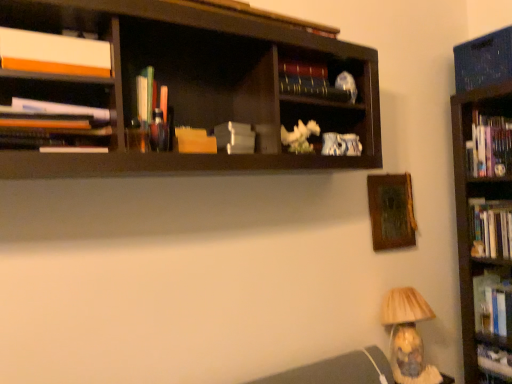
Question: Is hardcover books at right, the 8th book from the bottom, not near hardcover book at upper center, positioned as the first book in top-to-bottom order?

Choices:
 (A) yes
 (B) no

Answer: (A)

Question: Is hardcover books at right, which is the fourth book in top-to-bottom order, not within hardcover book at upper center, positioned as the first book in top-to-bottom order?

Choices:
 (A) yes
 (B) no

Answer: (A)

Question: Is hardcover books at right, which is the fourth book in top-to-bottom order, in contact with hardcover book at upper center, which is the 11th book in bottom-to-top order?

Choices:
 (A) no
 (B) yes

Answer: (A)

Question: Is the position of hardcover books at right, which is the fourth book in top-to-bottom order, more distant than that of hardcover book at upper center, which is the 11th book in bottom-to-top order?

Choices:
 (A) yes
 (B) no

Answer: (A)

Question: Is hardcover books at right, which is the fourth book in top-to-bottom order, to the right of hardcover book at upper center, which is the 11th book in bottom-to-top order, from the viewer's perspective?

Choices:
 (A) yes
 (B) no

Answer: (A)

Question: Is hardcover book at upper center, positioned as the first book in top-to-bottom order, located within hardcover books at right, the 8th book from the bottom?

Choices:
 (A) no
 (B) yes

Answer: (A)

Question: Can you confirm if hardcover book at center, which is the first book from bottom to top, is bigger than translucent plastic pens at center, the fifth book positioned from the top?

Choices:
 (A) no
 (B) yes

Answer: (B)

Question: From the image's perspective, is hardcover book at center, which is the first book from bottom to top, over translucent plastic pens at center, which appears as the seventh book when ordered from the bottom?

Choices:
 (A) yes
 (B) no

Answer: (B)

Question: Is hardcover book at center, which is the first book from bottom to top, oriented towards translucent plastic pens at center, the fifth book positioned from the top?

Choices:
 (A) no
 (B) yes

Answer: (A)

Question: Is hardcover book at center, which is the first book from bottom to top, oriented away from translucent plastic pens at center, the fifth book positioned from the top?

Choices:
 (A) yes
 (B) no

Answer: (B)

Question: Are hardcover book at center, which is the first book from bottom to top, and translucent plastic pens at center, which appears as the seventh book when ordered from the bottom, far apart?

Choices:
 (A) yes
 (B) no

Answer: (A)

Question: Is hardcover book at center, which is the first book from bottom to top, directly adjacent to translucent plastic pens at center, which appears as the seventh book when ordered from the bottom?

Choices:
 (A) no
 (B) yes

Answer: (A)

Question: Is white matte book at upper left, the ninth book in the bottom-to-top sequence, shorter than wooden picture frame at upper right?

Choices:
 (A) no
 (B) yes

Answer: (B)